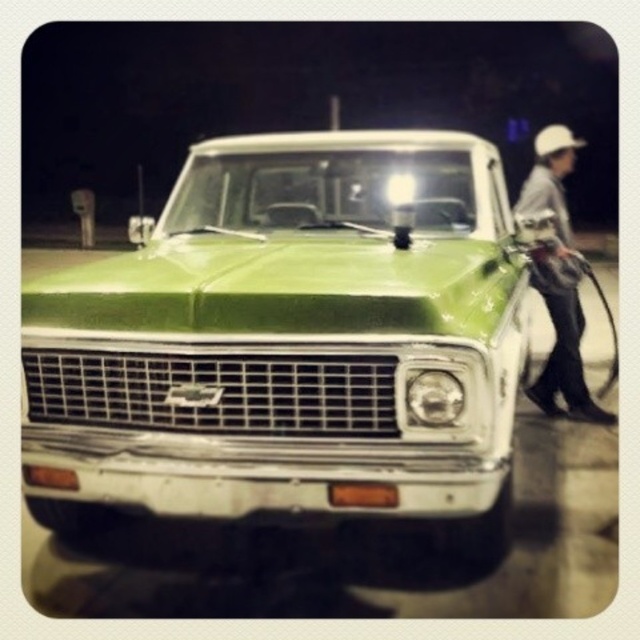
You are standing at the point labeled as point (x=291, y=342) in the image. Based on the scene description, what object is directly in front of you?

The point (x=291, y=342) indicates the green glossy truck at center, so the object directly in front of you is the green glossy truck at center.

You are standing in front of the green glossy truck at center and want to hand a tool to the person wearing the white hard hat at right without moving from your position. In which direction should you extend your arm to reach them?

Since the green glossy truck at center is to the left of the white hard hat at right, you should extend your arm to the right to reach the person wearing the white hard hat at right.

You are a delivery driver who needs to refuel your green glossy truck at center. You see a white hard hat at right nearby. Is the fuel nozzle within reach of the truck?

The green glossy truck at center is located below the white hard hat at right, which means the fuel nozzle being held by the person with the white hard hat is likely within reach to refuel the truck.